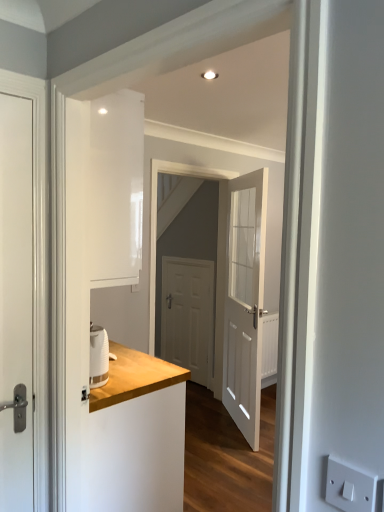
Question: Considering the positions of white wooden door at center, positioned as the second door in front-to-back order, and white matte door at center, positioned as the 3th door in front-to-back order, in the image, is white wooden door at center, positioned as the second door in front-to-back order, taller or shorter than white matte door at center, positioned as the 3th door in front-to-back order,?

Choices:
 (A) short
 (B) tall

Answer: (B)

Question: Is white wooden door at center, which ranks as the 2th door in back-to-front order, in front of or behind white matte door at center, positioned as the 3th door in front-to-back order, in the image?

Choices:
 (A) behind
 (B) front

Answer: (B)

Question: Which of these objects is positioned closest to the white matte door at left, which ranks as the 1th door in front-to-back order?

Choices:
 (A) white wooden door at center, positioned as the second door in front-to-back order
 (B) white plastic electric outlet at lower right
 (C) wooden counter at left
 (D) white matte door at center, positioned as the 3th door in front-to-back order

Answer: (C)

Question: Estimate the real-world distances between objects in this image. Which object is closer to the white matte door at left, the 3th door from the right?

Choices:
 (A) wooden counter at left
 (B) white wooden door at center, which is the 3th door in left-to-right order
 (C) white plastic electric outlet at lower right
 (D) white matte door at center, positioned as the second door in right-to-left order

Answer: (A)